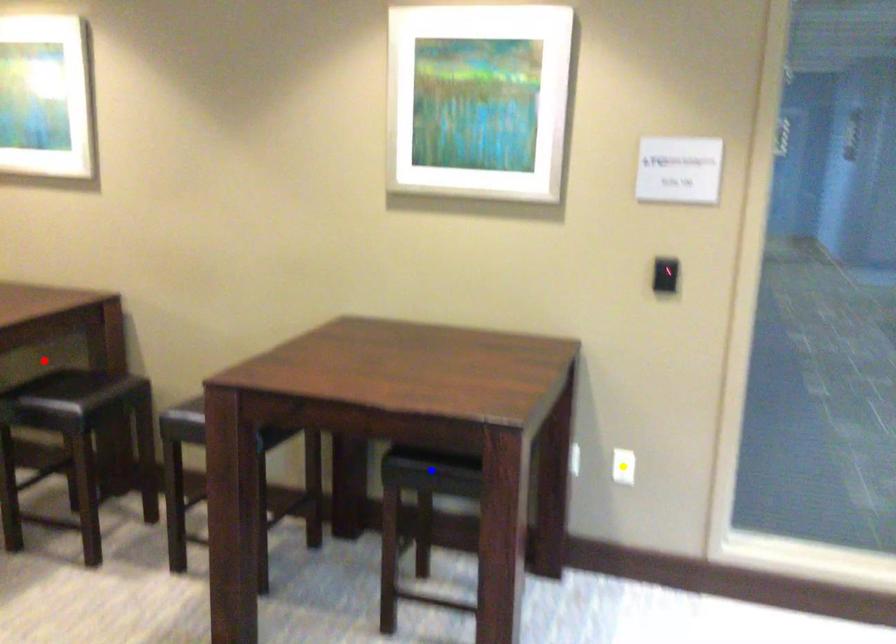
Order these from nearest to farthest:
yellow point
red point
blue point

blue point
yellow point
red point